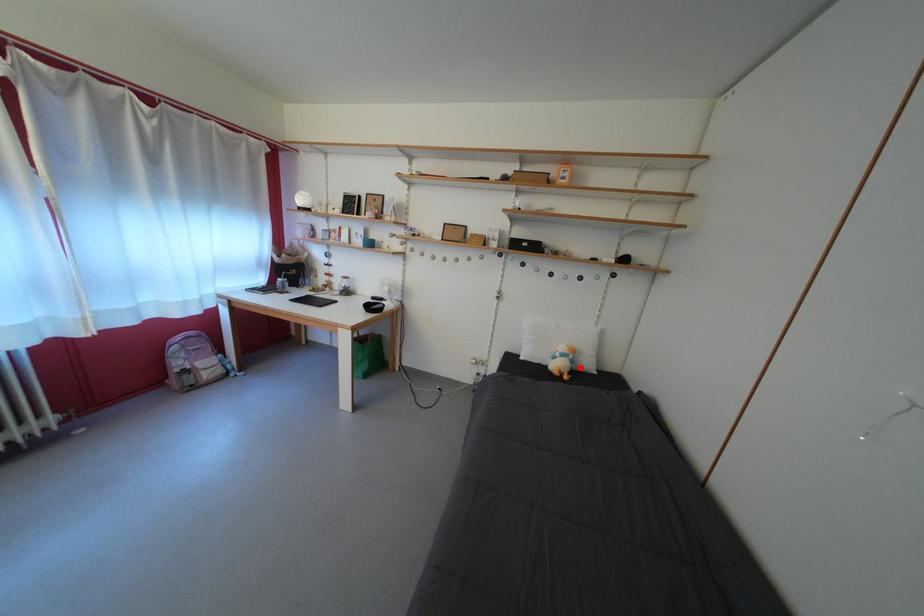
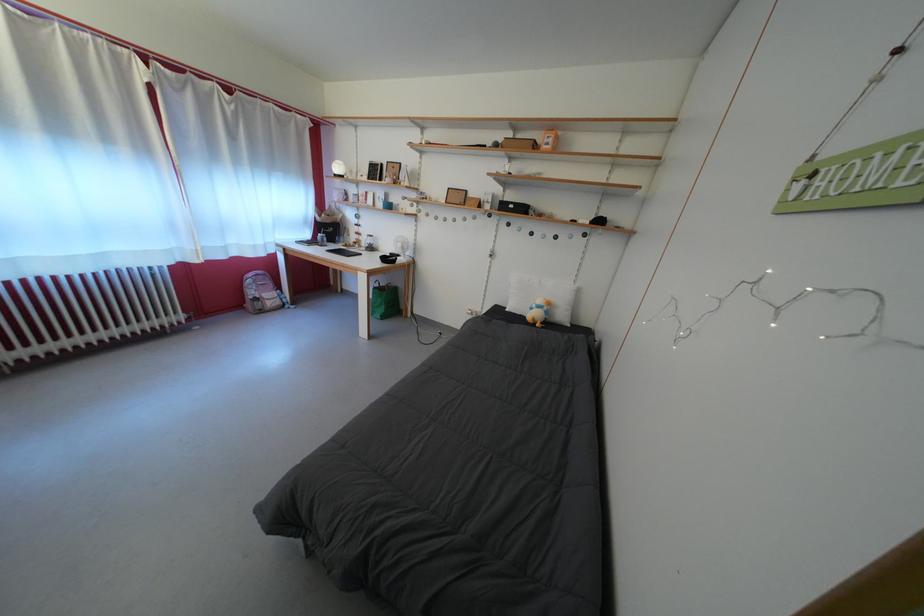
Question: I am providing you with two images of the same scene from different viewpoints. A red point is shown in image1. For the corresponding object point in image2, is it positioned nearer or farther from the camera?

Choices:
 (A) Nearer
 (B) Farther

Answer: (A)